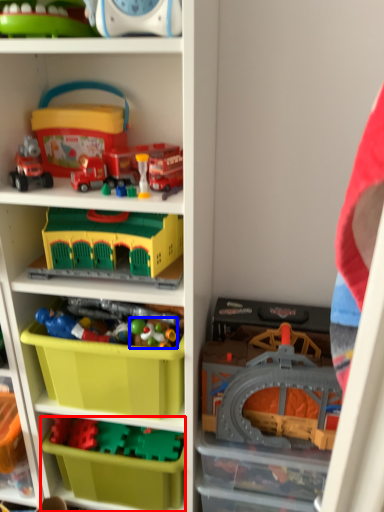
Question: Among these objects, which one is nearest to the camera, storage box (highlighted by a red box) or toy (highlighted by a blue box)?

Choices:
 (A) storage box
 (B) toy

Answer: (B)